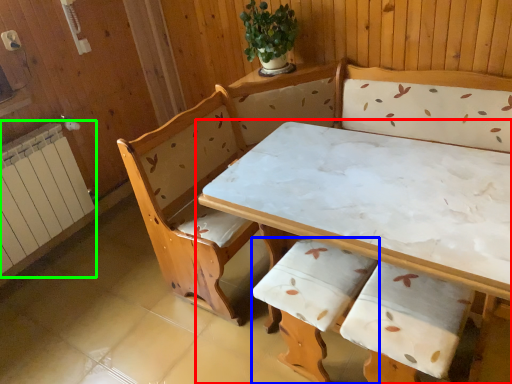
Question: Which object is the farthest from table (highlighted by a red box)? Choose among these: armchair (highlighted by a blue box) or radiator (highlighted by a green box).

Choices:
 (A) armchair
 (B) radiator

Answer: (B)